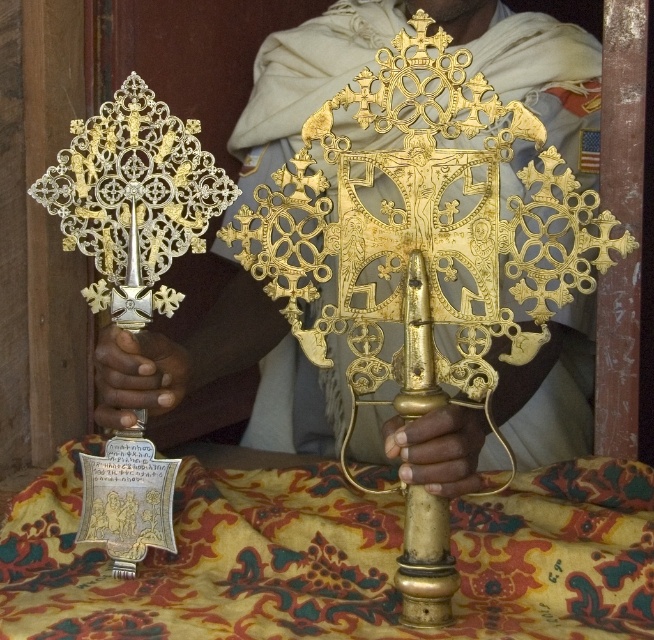
Question: Does gold metallic cross at center have a larger size compared to golden polished hand at center?

Choices:
 (A) no
 (B) yes

Answer: (B)

Question: Does floral-patterned fabric at center have a lesser width compared to golden polished hand at center?

Choices:
 (A) yes
 (B) no

Answer: (B)

Question: Which of these objects is positioned farthest from the golden polished hand at center?

Choices:
 (A) gold metallic hand at center
 (B) gold metallic cross at center

Answer: (A)

Question: Which object appears farthest from the camera in this image?

Choices:
 (A) gold metallic hand at center
 (B) golden polished hand at center

Answer: (B)

Question: Can you confirm if floral-patterned fabric at center is positioned above gold metallic cross at center?

Choices:
 (A) yes
 (B) no

Answer: (B)

Question: Which is farther from the gold metallic cross at center?

Choices:
 (A) floral-patterned fabric at center
 (B) golden polished hand at center
 (C) gold metallic hand at center

Answer: (C)